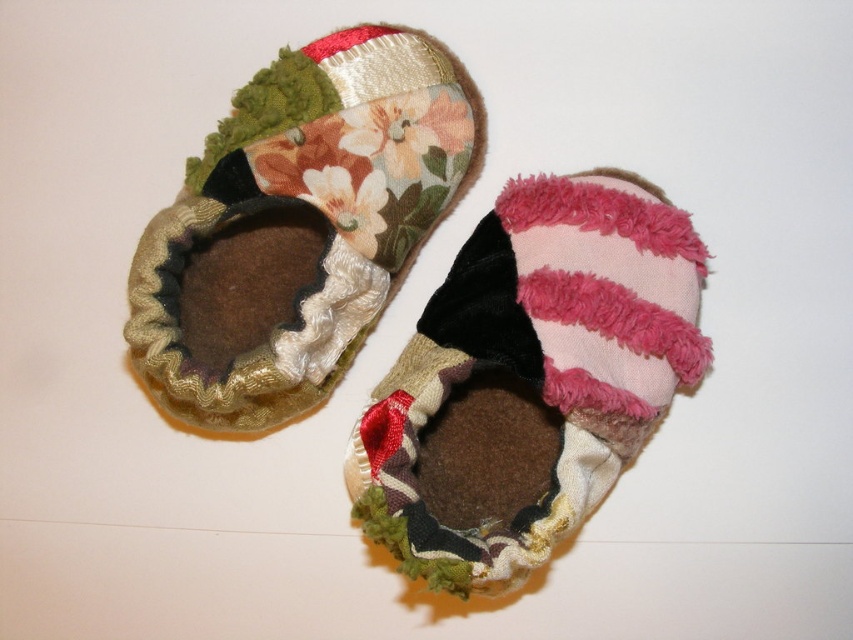
You are a parent trying to choose between the pink fuzzy slipper at center and the floral fabric bootie at center for your baby. Considering their heights, which one might be more suitable for outdoor use in a slightly chilly environment?

The floral fabric bootie at center has a greater height than the pink fuzzy slipper at center, making it more suitable for outdoor use in a slightly chilly environment as it provides better coverage and warmth.

You are a parent trying to place both the pink fuzzy slipper at center and the floral fabric bootie at center into a storage box that can only hold items within a 6 inch diameter. Can both items fit inside the box without overlapping?

The pink fuzzy slipper at center and floral fabric bootie at center are 8.18 inches apart from each other, which exceeds the 6 inch diameter of the storage box. Therefore, both items cannot fit inside the box without overlapping.